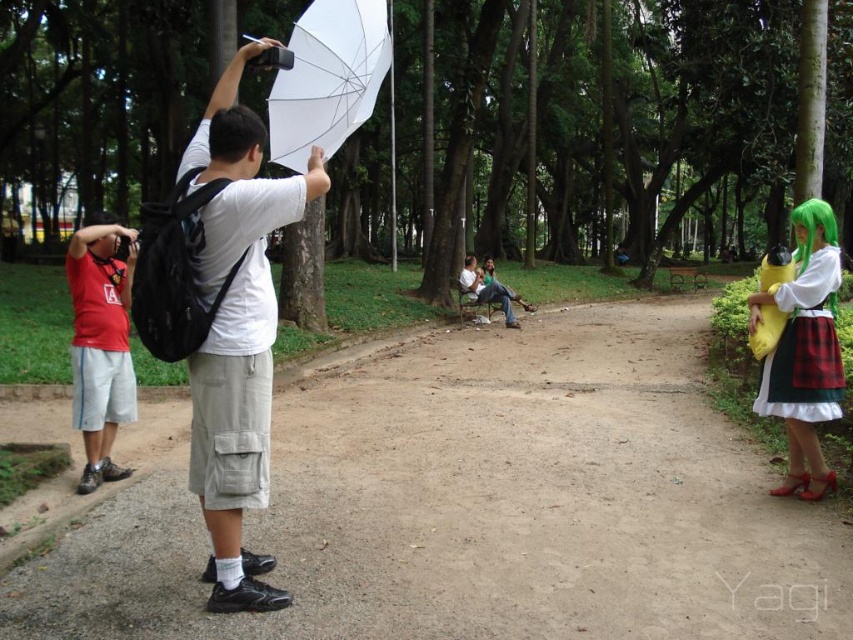
Question: Considering the real-world distances, which object is closest to the white fabric chair at center?

Choices:
 (A) matte green wig at right
 (B) dirt path at center

Answer: (B)

Question: Which object is positioned farthest from the matte white umbrella at upper left?

Choices:
 (A) matte red t-shirt at left
 (B) white matte umbrella at upper center
 (C) white fabric chair at center

Answer: (C)

Question: Does matte green wig at right appear over white matte umbrella at upper center?

Choices:
 (A) no
 (B) yes

Answer: (A)

Question: Where is matte green wig at right located in relation to matte red t-shirt at left in the image?

Choices:
 (A) left
 (B) right

Answer: (B)

Question: Does matte white umbrella at upper left have a greater width compared to white fabric chair at center?

Choices:
 (A) no
 (B) yes

Answer: (A)

Question: Which object is positioned closest to the matte red t-shirt at left?

Choices:
 (A) matte green wig at right
 (B) matte white umbrella at upper left
 (C) white matte umbrella at upper center

Answer: (C)